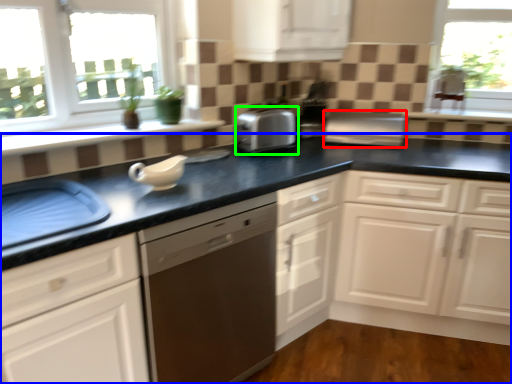
Question: Which object is the farthest from appliance (highlighted by a red box)? Choose among these: countertop (highlighted by a blue box) or home appliance (highlighted by a green box).

Choices:
 (A) countertop
 (B) home appliance

Answer: (B)